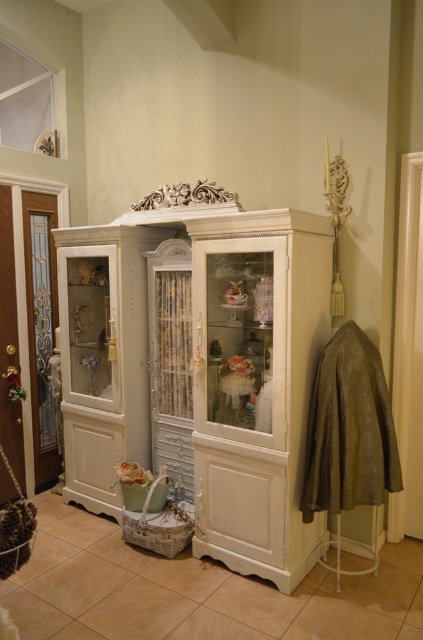
Who is positioned more to the right, white glossy cabinet at center or translucent glass door at left?

From the viewer's perspective, white glossy cabinet at center appears more on the right side.

Is white glossy cabinet at center closer to camera compared to translucent glass door at left?

That is True.

From the picture: Who is more distant from viewer, (266, 304) or (36, 433)?

The point (36, 433) is more distant.

Find the location of a particular element. Image resolution: width=423 pixels, height=640 pixels. white glossy cabinet at center is located at coordinates (202, 371).